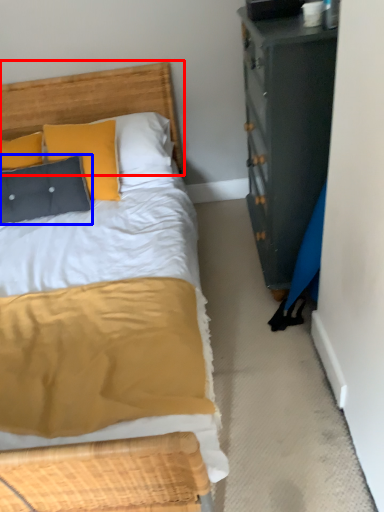
Question: Which object appears closest to the camera in this image, headboard (highlighted by a red box) or pillow (highlighted by a blue box)?

Choices:
 (A) headboard
 (B) pillow

Answer: (A)